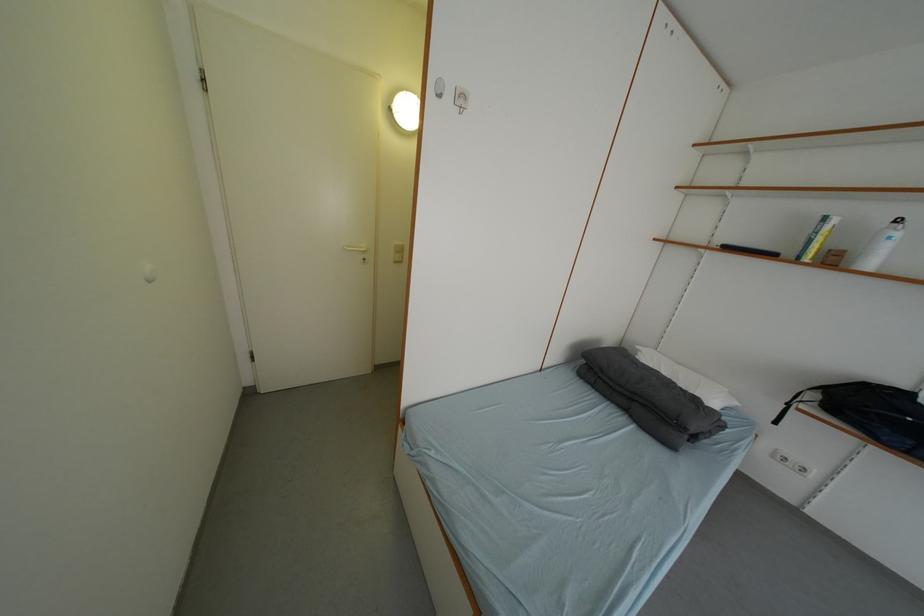
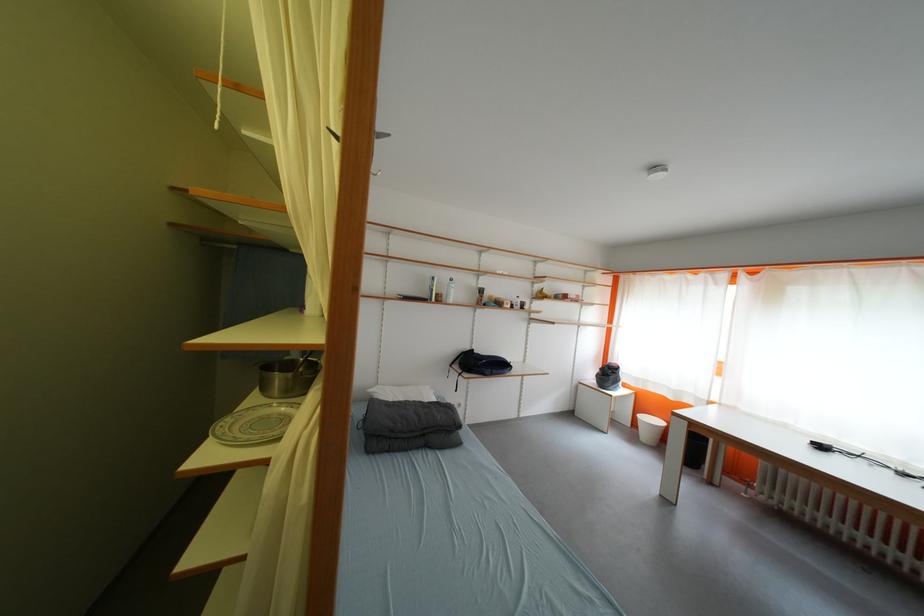
Find the pixel in the second image that matches point (641, 403) in the first image.

(432, 438)